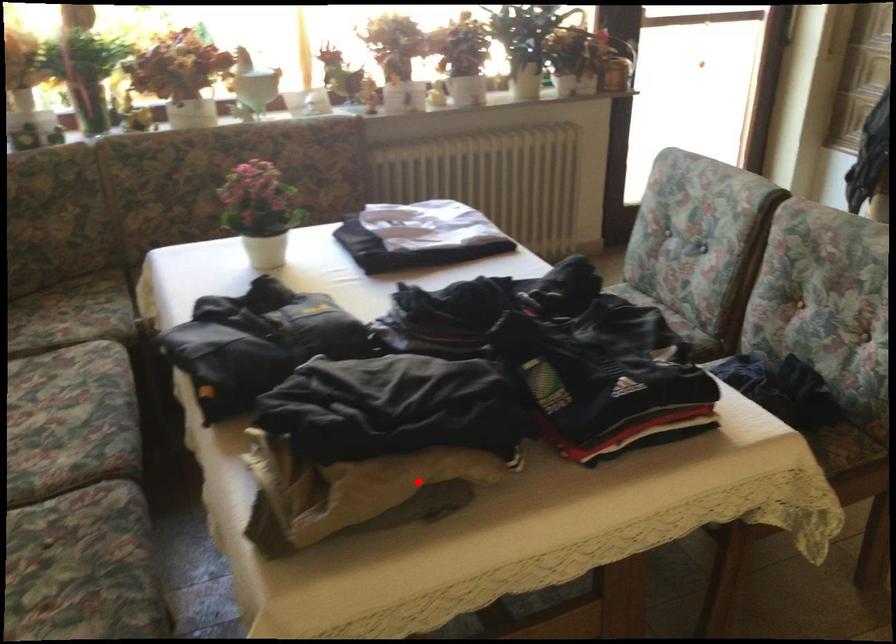
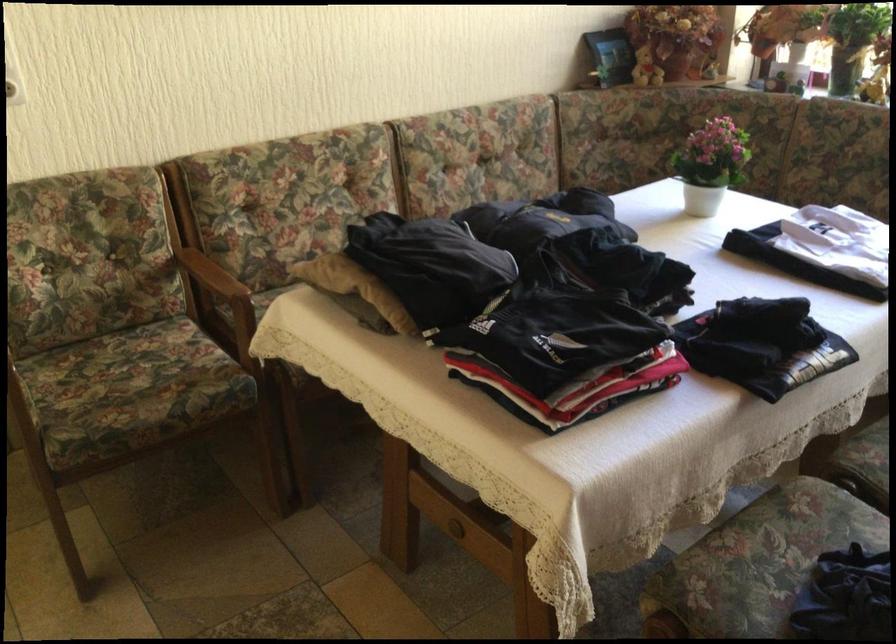
Question: I am providing you with two images of the same scene from different viewpoints. In image1, a red point is highlighted. Considering the same 3D point in image2, which of the following is correct?

Choices:
 (A) It is closer
 (B) It is farther

Answer: (B)